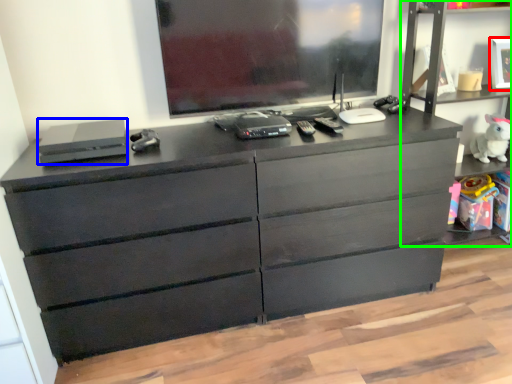
Question: Which is nearer to the picture frame (highlighted by a red box)? equipment (highlighted by a blue box) or tv cabinet (highlighted by a green box).

Choices:
 (A) equipment
 (B) tv cabinet

Answer: (B)